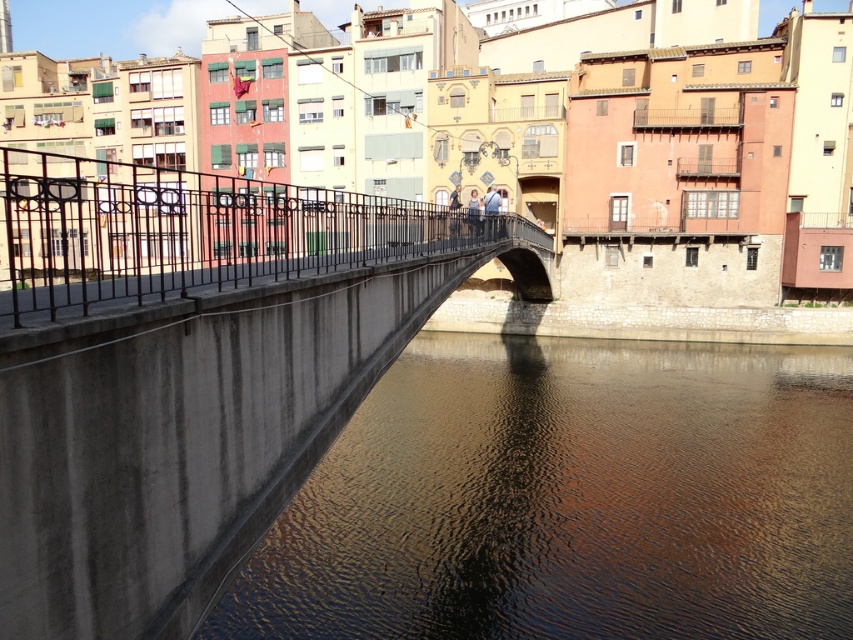
Question: Can you confirm if concrete bridge at center is positioned to the left of light brown leather jacket at center?

Choices:
 (A) no
 (B) yes

Answer: (B)

Question: Observing the image, what is the correct spatial positioning of concrete bridge at center in reference to brown concrete water at lower left?

Choices:
 (A) below
 (B) above

Answer: (B)

Question: Which of these objects is positioned closest to the matte blue jeans at center?

Choices:
 (A) brown concrete water at lower left
 (B) concrete bridge at center

Answer: (A)

Question: Which of the following is the farthest from the observer?

Choices:
 (A) (33, 484)
 (B) (485, 218)
 (C) (474, 224)

Answer: (B)

Question: Does concrete bridge at center have a greater width compared to brown concrete water at lower left?

Choices:
 (A) yes
 (B) no

Answer: (A)

Question: Which object is farther from the camera taking this photo?

Choices:
 (A) light brown leather jacket at center
 (B) matte blue jeans at center

Answer: (B)